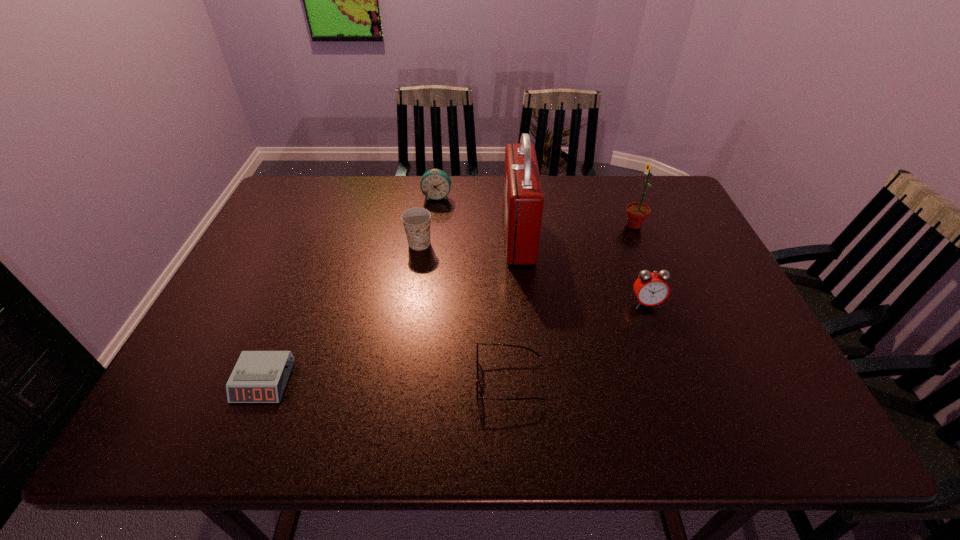
The image size is (960, 540). I want to click on the tallest object, so click(523, 199).

Identify the location of the second tallest object. This screenshot has width=960, height=540. (637, 213).

The width and height of the screenshot is (960, 540). In order to click on the farthest object in this screenshot , I will do `click(435, 184)`.

At what (x,y) coordinates should I click in order to perform the action: click on the farthest alarm clock. Please return your answer as a coordinate pair (x, y). Looking at the image, I should click on (435, 184).

This screenshot has width=960, height=540. Find the location of `the second nearest alarm clock`. the second nearest alarm clock is located at coordinates (651, 289).

Where is `the third nearest object`? The height and width of the screenshot is (540, 960). the third nearest object is located at coordinates (651, 289).

The height and width of the screenshot is (540, 960). I want to click on Dixie cup, so click(416, 221).

Identify the location of the second shortest object. (477, 376).

You are a GUI agent. You are given a task and a screenshot of the screen. Output one action in this format:
    pyautogui.click(x=<x>, y=<y>)
    Task: Click on the leftmost alarm clock
    The height and width of the screenshot is (540, 960).
    Given the screenshot: What is the action you would take?
    pyautogui.click(x=259, y=376)

What are the coordinates of `the shortest alarm clock` in the screenshot? It's located at (259, 376).